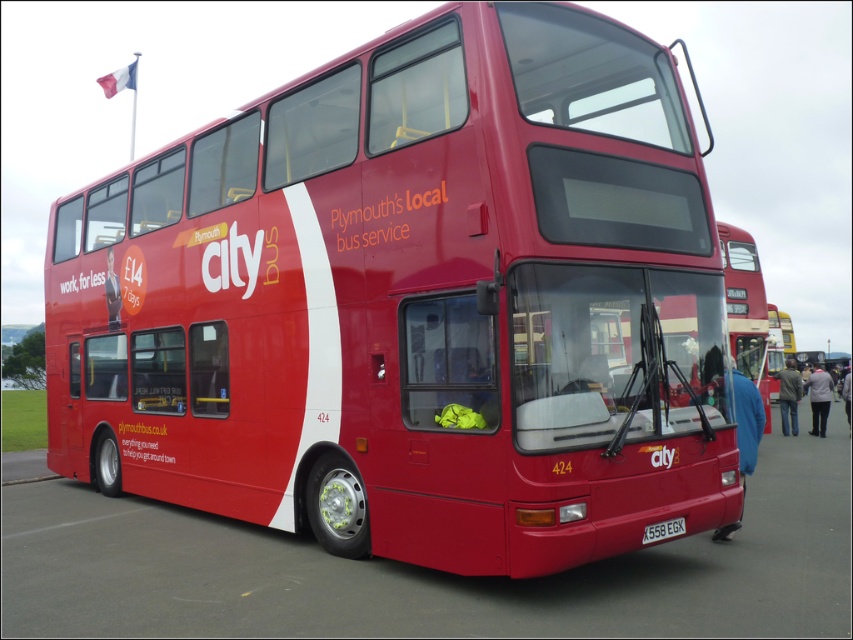
You are standing in front of the Plymouth local city bus service, number 424, and notice two points marked on its side. The first point is at coordinates point (653, 616) and the second at point (654, 536). Which of these two points is nearer to your viewpoint?

Point (653, 616) is closer to the camera than point (654, 536), so the first point is nearer to your viewpoint.

You are a pedestrian standing at the edge of the road. You see the shiny red bus at center and the red rubber parking lot at lower center. Which object is higher up in the image?

The shiny red bus at center is above the red rubber parking lot at lower center, so the shiny red bus at center is higher up in the image.

You are a photographer trying to capture the shiny red bus at center and the red rubber parking lot at lower center in a single frame. Based on their sizes, which object should you focus on first to ensure both fit in the shot?

The shiny red bus at center is thinner than the red rubber parking lot at lower center, so you should focus on the wider red rubber parking lot at lower center first to ensure both fit in the shot.